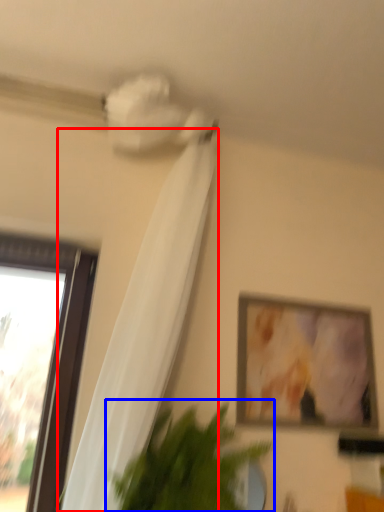
Question: Which object appears farthest to the camera in this image, curtain (highlighted by a red box) or houseplant (highlighted by a blue box)?

Choices:
 (A) curtain
 (B) houseplant

Answer: (B)